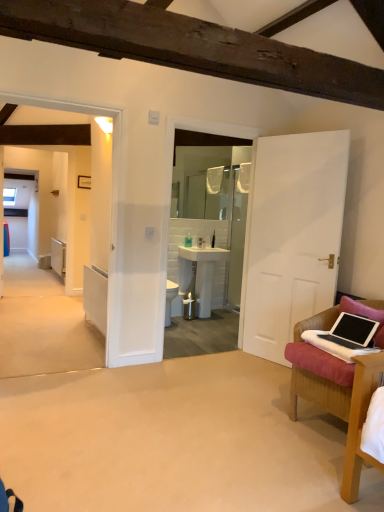
Describe the element at coordinates (84, 182) in the screenshot. The image size is (384, 512). I see `wooden picture frame at upper center` at that location.

The height and width of the screenshot is (512, 384). Describe the element at coordinates (291, 236) in the screenshot. I see `white matte door at right` at that location.

Measure the distance between white frosted glass mirror at center and camera.

The distance of white frosted glass mirror at center from camera is 20.99 feet.

In order to face metallic silver trash can at center, should I rotate leftwards or rightwards?

To align with it, rotate left about 0.300°.

Identify the location of wooden picture frame at upper center. This screenshot has width=384, height=512. (84, 182).

Considering the relative sizes of metallic silver trash can at center and white frosted glass mirror at center in the image provided, is metallic silver trash can at center thinner than white frosted glass mirror at center?

No, metallic silver trash can at center is not thinner than white frosted glass mirror at center.

Is metallic silver trash can at center bigger or smaller than white frosted glass mirror at center?

Clearly, metallic silver trash can at center is smaller in size than white frosted glass mirror at center.

From a real-world perspective, is metallic silver trash can at center positioned above or below white frosted glass mirror at center?

From a real-world perspective, metallic silver trash can at center is physically below white frosted glass mirror at center.

From a real-world perspective, who is located lower, wooden picture frame at upper center or translucent plastic bottle at center?

translucent plastic bottle at center.

What's the angular difference between wooden picture frame at upper center and translucent plastic bottle at center's facing directions?

The angular difference between wooden picture frame at upper center and translucent plastic bottle at center is 11.5 degrees.

This screenshot has height=512, width=384. Find the location of `picture frame behind the translucent plastic bottle at center`. picture frame behind the translucent plastic bottle at center is located at coordinates (84, 182).

Is point (90, 180) closer to viewer compared to point (190, 234)?

Yes, it is in front of point (190, 234).

Which object is further away from the camera, pink fabric pillow at right or metallic silver trash can at center?

Positioned behind is metallic silver trash can at center.

Locate an element on the screen. Image resolution: width=384 pixels, height=512 pixels. pillow positioned vertically above the metallic silver trash can at center (from a real-world perspective) is located at coordinates (365, 316).

Consider the image. Is pink fabric pillow at right next to metallic silver trash can at center?

No.

Looking at this image, which object is closer to the camera taking this photo, metallic silver trash can at center or white glossy sink at center?

Positioned in front is white glossy sink at center.

Is metallic silver trash can at center not within white glossy sink at center?

No.

Are metallic silver trash can at center and white glossy sink at center far apart?

That's not correct — metallic silver trash can at center is a little close to white glossy sink at center.

From a real-world perspective, is metallic silver trash can at center positioned above or below white glossy sink at center?

metallic silver trash can at center is situated lower than white glossy sink at center in the real world.

Based on their sizes in the image, would you say white frosted glass mirror at center is bigger or smaller than metallic silver trash can at center?

Considering their sizes, white frosted glass mirror at center takes up more space than metallic silver trash can at center.

At what (x,y) coordinates should I click in order to perform the action: click on mirror above the metallic silver trash can at center (from the image's perspective). Please return your answer as a coordinate pair (x, y). Looking at the image, I should click on (201, 181).

Is point (196, 152) positioned in front of point (191, 318)?

No, it is behind (191, 318).

Considering the sizes of objects white frosted glass mirror at center and metallic silver trash can at center in the image provided, who is shorter, white frosted glass mirror at center or metallic silver trash can at center?

Standing shorter between the two is metallic silver trash can at center.

How far apart are white matte door at right and pink fabric pillow at right?

They are 3.40 feet apart.

Are white matte door at right and pink fabric pillow at right far apart?

That's right, there is a large distance between white matte door at right and pink fabric pillow at right.

From the picture: Considering their positions, is white matte door at right located in front of or behind pink fabric pillow at right?

In the image, white matte door at right appears behind pink fabric pillow at right.

Considering the relative sizes of white matte door at right and pink fabric pillow at right in the image provided, is white matte door at right taller than pink fabric pillow at right?

Indeed, white matte door at right has a greater height compared to pink fabric pillow at right.

Looking at the image, does pink fabric pillow at right seem bigger or smaller compared to wooden picture frame at upper center?

In the image, pink fabric pillow at right appears to be larger than wooden picture frame at upper center.

Considering the sizes of pink fabric pillow at right and wooden picture frame at upper center in the image, is pink fabric pillow at right wider or thinner than wooden picture frame at upper center?

In the image, pink fabric pillow at right appears to be wider than wooden picture frame at upper center.

The image size is (384, 512). What are the coordinates of `mirror above the metallic silver trash can at center (from a real-world perspective)` in the screenshot? It's located at (201, 181).

Locate an element on the screen. picture frame on the left of the translucent plastic bottle at center is located at coordinates (84, 182).

Based on their spatial positions, is pink fabric pillow at right or white matte door at right further from black matte laptop at lower right?

white matte door at right lies further to black matte laptop at lower right than the other object.

Considering their positions, is white glossy sink at center positioned further to white frosted glass mirror at center than wooden picture frame at upper center?

The object further to white frosted glass mirror at center is white glossy sink at center.

Estimate the real-world distances between objects in this image. Which object is closer to pink fabric pillow at right, metallic silver trash can at center or wooden picture frame at upper center?

metallic silver trash can at center is closer to pink fabric pillow at right.

When comparing their distances from white matte door at right, does leather-like brown chair at lower right or metallic silver trash can at center seem closer?

leather-like brown chair at lower right is closer to white matte door at right.

Estimate the real-world distances between objects in this image. Which object is further from leather-like brown chair at lower right, white frosted glass mirror at center or translucent plastic bottle at center?

white frosted glass mirror at center lies further to leather-like brown chair at lower right than the other object.

Based on their spatial positions, is white glossy sink at center or pink fabric pillow at right further from black matte laptop at lower right?

white glossy sink at center is positioned further to the anchor black matte laptop at lower right.

When comparing their distances from metallic silver trash can at center, does white matte door at right or black matte laptop at lower right seem closer?

Based on the image, white matte door at right appears to be nearer to metallic silver trash can at center.

Considering their positions, is pink fabric pillow at right positioned closer to black matte laptop at lower right than metallic silver trash can at center?

pink fabric pillow at right.

Identify the location of laptop between leather-like brown chair at lower right and white glossy sink at center along the z-axis. The width and height of the screenshot is (384, 512). (352, 331).

You are a GUI agent. You are given a task and a screenshot of the screen. Output one action in this format:
    pyautogui.click(x=<x>, y=<y>)
    Task: Click on the door positioned between leather-like brown chair at lower right and white frosted glass mirror at center from near to far
    
    Given the screenshot: What is the action you would take?
    pyautogui.click(x=291, y=236)

The image size is (384, 512). Identify the location of door between leather-like brown chair at lower right and wooden picture frame at upper center along the z-axis. (291, 236).

In order to click on pillow between leather-like brown chair at lower right and metallic silver trash can at center along the z-axis in this screenshot , I will do 365,316.